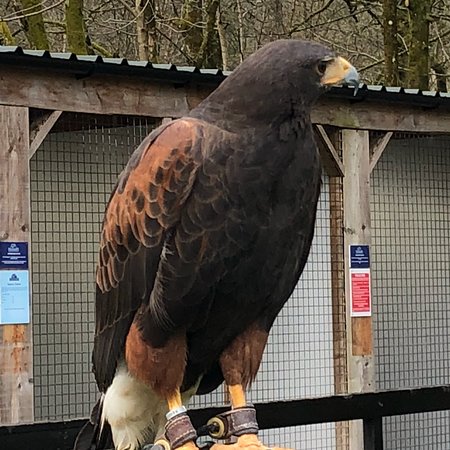
At what (x,y) coordinates should I click in order to perform the action: click on grommet. Please return your answer as a coordinate pair (x, y). The image size is (450, 450). Looking at the image, I should click on (219, 430).